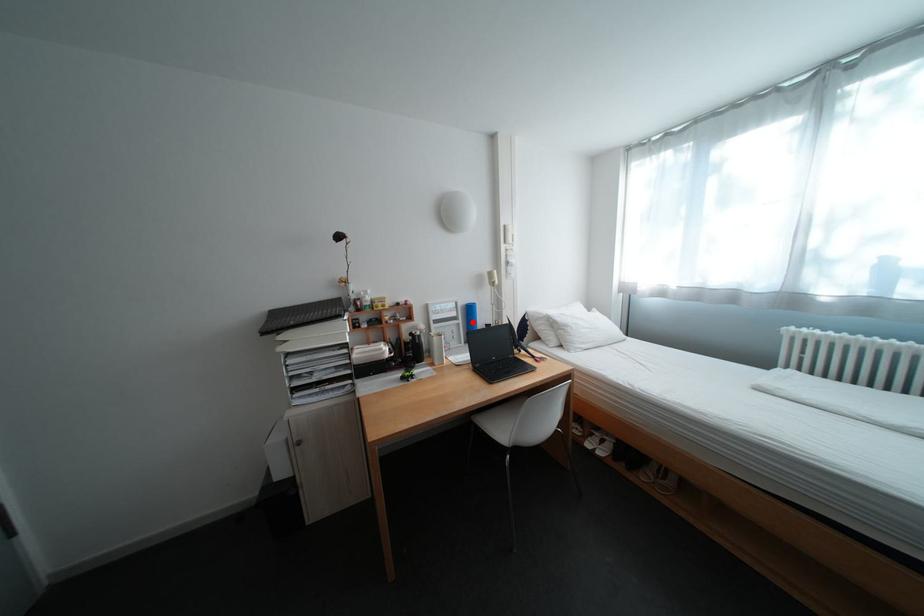
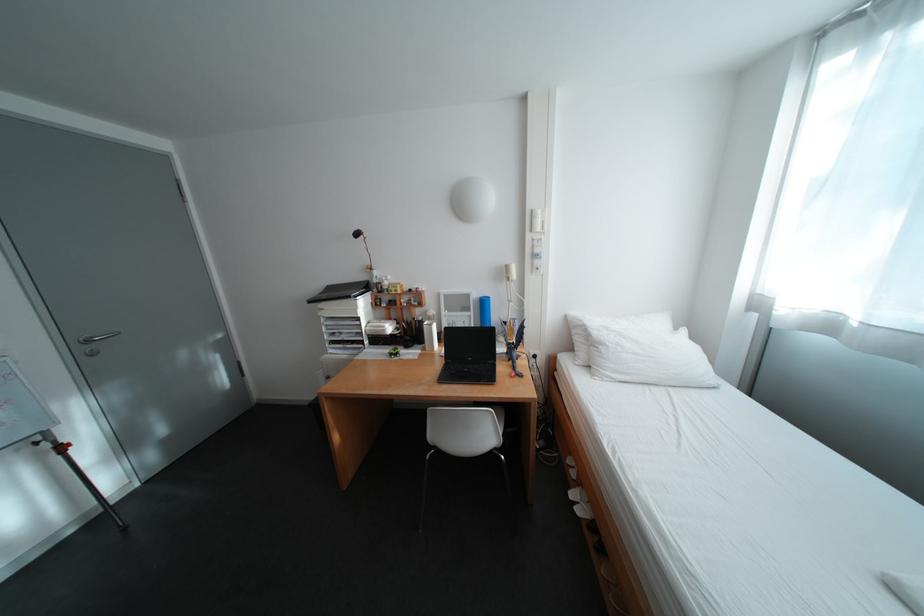
Locate, in the second image, the point that corresponds to the highlighted location in the first image.

(484, 314)